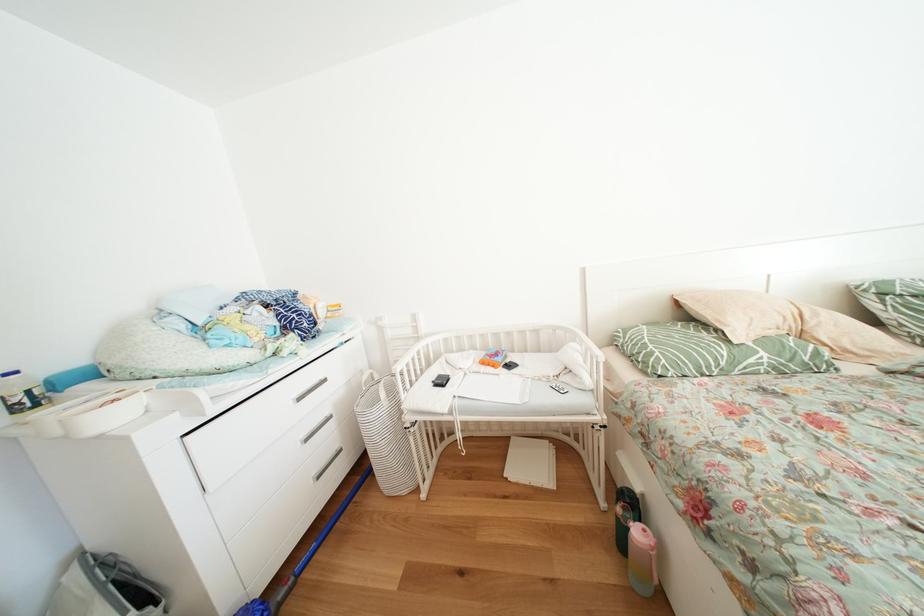
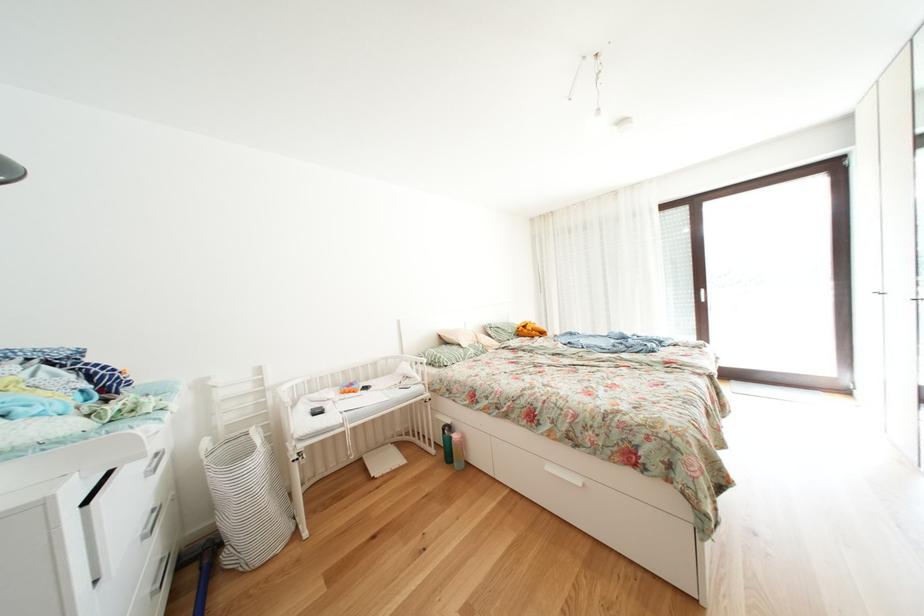
The point at (612,509) is marked in the first image. Where is the corresponding point in the second image?

(443, 456)